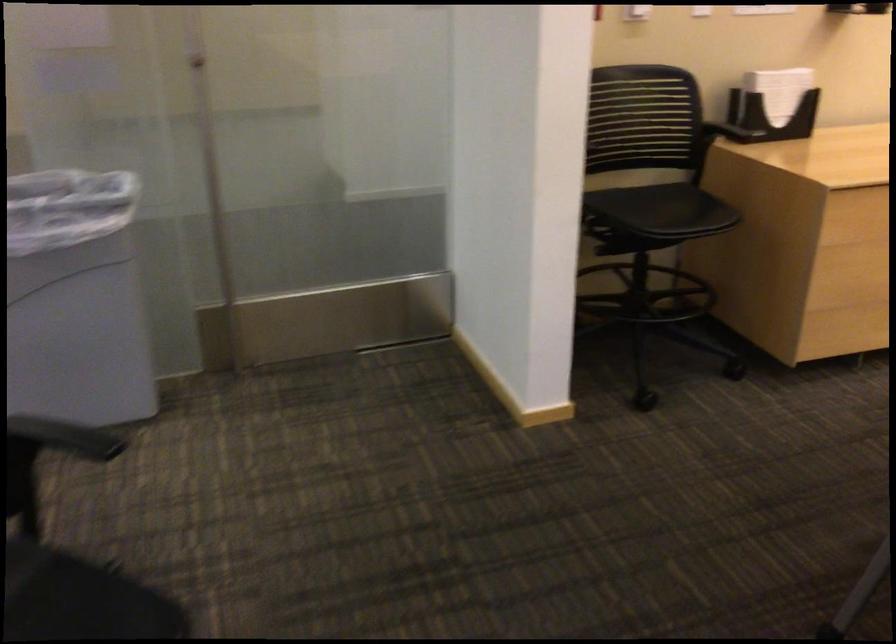
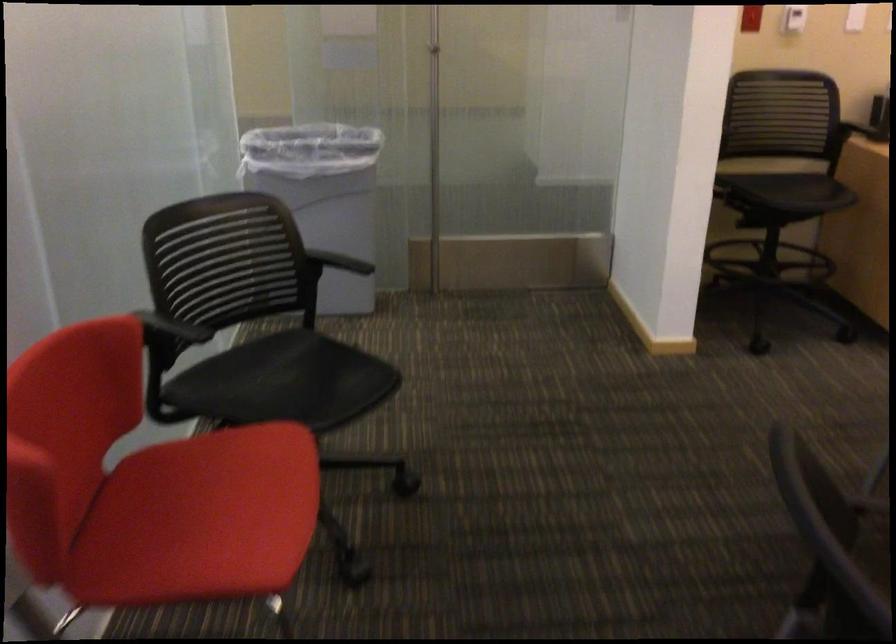
Locate, in the second image, the point that corresponds to point 718,138 in the first image.

(858, 131)